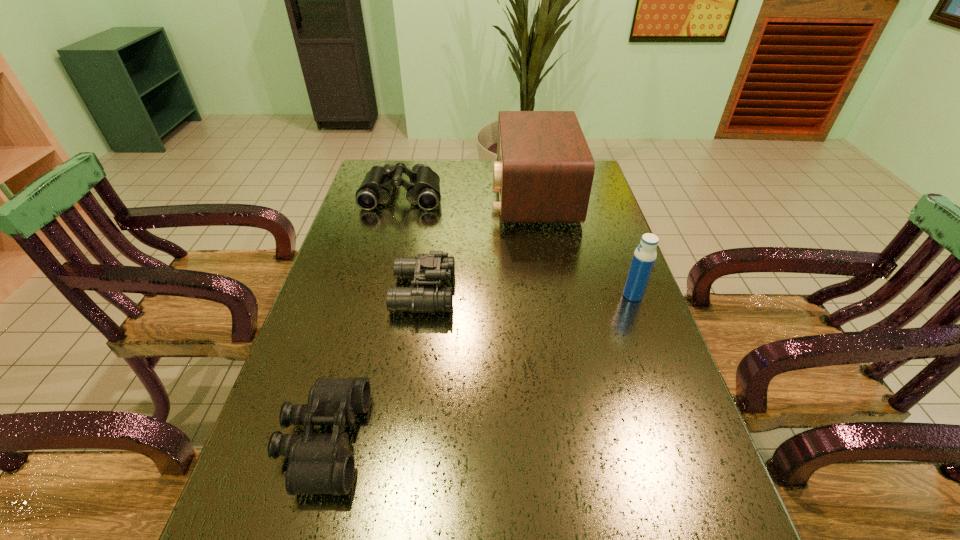
What are the coordinates of `empty space between the shortest object and the second tallest object` in the screenshot? It's located at (478, 368).

Identify the location of free space between the water bottle and the farthest binoculars. The height and width of the screenshot is (540, 960). (517, 245).

Where is `free point between the rightmost object and the farthest binoculars`? This screenshot has width=960, height=540. free point between the rightmost object and the farthest binoculars is located at coordinates (517, 245).

This screenshot has width=960, height=540. I want to click on free space that is in between the radio receiver and the farthest binoculars, so click(468, 194).

Select which object is the third closest to the farthest binoculars. Please provide its 2D coordinates. Your answer should be formatted as a tuple, i.e. [(x, y)], where the tuple contains the x and y coordinates of a point satisfying the conditions above.

[(645, 255)]

Identify which object is located as the second nearest to the second object from right to left. Please provide its 2D coordinates. Your answer should be formatted as a tuple, i.e. [(x, y)], where the tuple contains the x and y coordinates of a point satisfying the conditions above.

[(424, 269)]

Locate which binoculars is the second closest to the second object from right to left. Please provide its 2D coordinates. Your answer should be formatted as a tuple, i.e. [(x, y)], where the tuple contains the x and y coordinates of a point satisfying the conditions above.

[(424, 269)]

This screenshot has width=960, height=540. I want to click on the closest binoculars to the rightmost object, so click(x=424, y=269).

Locate an element on the screen. free space that satisfies the following two spatial constraints: 1. on the front-facing side of the farthest binoculars; 2. at the eyepieces of the shortest binoculars is located at coordinates (342, 441).

Where is `vacant space that satisfies the following two spatial constraints: 1. on the front panel of the fourth object from left to right; 2. on the back side of the water bottle`? vacant space that satisfies the following two spatial constraints: 1. on the front panel of the fourth object from left to right; 2. on the back side of the water bottle is located at coordinates (550, 295).